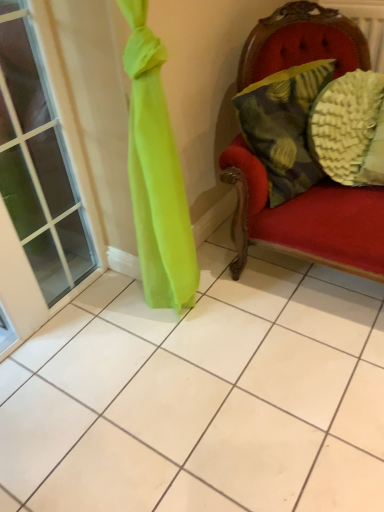
Question: Can you confirm if textured yellow pillow at right, the 1th pillow viewed from the right, is positioned to the left of clear glass window at left?

Choices:
 (A) no
 (B) yes

Answer: (A)

Question: From the image's perspective, is textured yellow pillow at right, the 1th pillow viewed from the right, below clear glass window at left?

Choices:
 (A) no
 (B) yes

Answer: (A)

Question: From the image's perspective, is textured yellow pillow at right, which ranks as the second pillow in left-to-right order, located above clear glass window at left?

Choices:
 (A) no
 (B) yes

Answer: (B)

Question: Does textured yellow pillow at right, the 1th pillow viewed from the right, have a lesser height compared to clear glass window at left?

Choices:
 (A) no
 (B) yes

Answer: (B)

Question: Are textured yellow pillow at right, which ranks as the second pillow in left-to-right order, and clear glass window at left far apart?

Choices:
 (A) yes
 (B) no

Answer: (A)

Question: Does textured yellow pillow at right, the 1th pillow viewed from the right, come in front of clear glass window at left?

Choices:
 (A) no
 (B) yes

Answer: (A)

Question: Considering the relative positions of clear glass window at left and textured yellow-green pillow at right, positioned as the 1th pillow in left-to-right order, in the image provided, is clear glass window at left behind textured yellow-green pillow at right, positioned as the 1th pillow in left-to-right order,?

Choices:
 (A) no
 (B) yes

Answer: (A)

Question: Considering the relative sizes of clear glass window at left and textured yellow-green pillow at right, which ranks as the 2th pillow in right-to-left order, in the image provided, is clear glass window at left wider than textured yellow-green pillow at right, which ranks as the 2th pillow in right-to-left order,?

Choices:
 (A) no
 (B) yes

Answer: (A)

Question: Can you confirm if clear glass window at left is bigger than textured yellow-green pillow at right, which ranks as the 2th pillow in right-to-left order?

Choices:
 (A) no
 (B) yes

Answer: (B)

Question: From a real-world perspective, is clear glass window at left physically above textured yellow-green pillow at right, which ranks as the 2th pillow in right-to-left order?

Choices:
 (A) no
 (B) yes

Answer: (A)

Question: Considering the relative positions of clear glass window at left and textured yellow-green pillow at right, positioned as the 1th pillow in left-to-right order, in the image provided, is clear glass window at left to the right of textured yellow-green pillow at right, positioned as the 1th pillow in left-to-right order, from the viewer's perspective?

Choices:
 (A) no
 (B) yes

Answer: (A)

Question: Is clear glass window at left facing towards textured yellow-green pillow at right, positioned as the 1th pillow in left-to-right order?

Choices:
 (A) no
 (B) yes

Answer: (A)

Question: Considering the relative sizes of textured yellow-green pillow at right, which ranks as the 2th pillow in right-to-left order, and clear glass window at left in the image provided, is textured yellow-green pillow at right, which ranks as the 2th pillow in right-to-left order, wider than clear glass window at left?

Choices:
 (A) yes
 (B) no

Answer: (A)